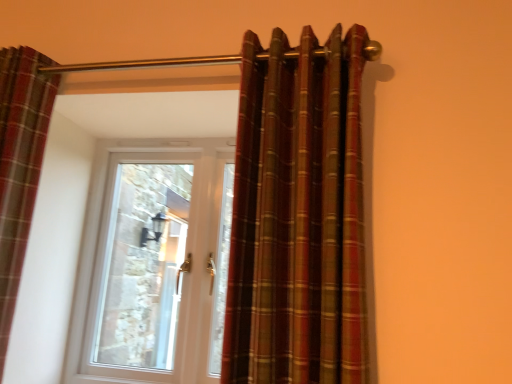
Question: Would you say plaid fabric curtain at center, positioned as the 1th curtain in right-to-left order, is inside or outside plaid fabric curtain at left, which is counted as the first curtain, starting from the left?

Choices:
 (A) outside
 (B) inside

Answer: (A)

Question: From the image's perspective, is plaid fabric curtain at center, the 2th curtain in the left-to-right sequence, above or below plaid fabric curtain at left, which ranks as the second curtain in right-to-left order?

Choices:
 (A) below
 (B) above

Answer: (B)

Question: Estimate the real-world distances between objects in this image. Which object is closer to the white plastic door at center?

Choices:
 (A) plaid fabric curtain at center, positioned as the 1th curtain in right-to-left order
 (B) plaid fabric curtain at left, which ranks as the second curtain in right-to-left order

Answer: (B)

Question: Which is nearer to the plaid fabric curtain at center, positioned as the 1th curtain in right-to-left order?

Choices:
 (A) plaid fabric curtain at left, which is counted as the first curtain, starting from the left
 (B) white plastic door at center

Answer: (A)